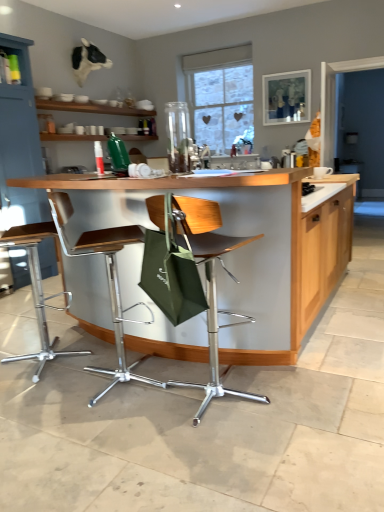
Question: Can you see metallic silver stool at center, positioned as the second chair in left-to-right order, touching matte blue cabinet at upper left?

Choices:
 (A) no
 (B) yes

Answer: (A)

Question: From a real-world perspective, is metallic silver stool at center, which is the second chair in right-to-left order, on top of matte blue cabinet at upper left?

Choices:
 (A) no
 (B) yes

Answer: (A)

Question: Can you confirm if metallic silver stool at center, positioned as the second chair in left-to-right order, is shorter than matte blue cabinet at upper left?

Choices:
 (A) no
 (B) yes

Answer: (B)

Question: Is metallic silver stool at center, positioned as the second chair in left-to-right order, looking in the opposite direction of matte blue cabinet at upper left?

Choices:
 (A) no
 (B) yes

Answer: (A)

Question: From a real-world perspective, is metallic silver stool at center, which is the second chair in right-to-left order, under matte blue cabinet at upper left?

Choices:
 (A) yes
 (B) no

Answer: (A)

Question: Choose the correct answer: Is transparent glass vase at center inside matte blue cabinet at upper left or outside it?

Choices:
 (A) outside
 (B) inside

Answer: (A)

Question: In terms of height, does transparent glass vase at center look taller or shorter compared to matte blue cabinet at upper left?

Choices:
 (A) tall
 (B) short

Answer: (B)

Question: From the image's perspective, is transparent glass vase at center located above or below matte blue cabinet at upper left?

Choices:
 (A) above
 (B) below

Answer: (B)

Question: From a real-world perspective, relative to matte blue cabinet at upper left, is transparent glass vase at center vertically above or below?

Choices:
 (A) above
 (B) below

Answer: (A)

Question: Is wooden countertop at center spatially inside transparent glass vase at center, or outside of it?

Choices:
 (A) outside
 (B) inside

Answer: (A)

Question: Is wooden countertop at center in front of or behind transparent glass vase at center in the image?

Choices:
 (A) front
 (B) behind

Answer: (A)

Question: Is point (281, 271) positioned closer to the camera than point (188, 121)?

Choices:
 (A) farther
 (B) closer

Answer: (B)

Question: Is wooden countertop at center wider or thinner than transparent glass vase at center?

Choices:
 (A) wide
 (B) thin

Answer: (A)

Question: In the image, is metallic silver stool at center, positioned as the second chair in left-to-right order, positioned in front of or behind wooden countertop at center?

Choices:
 (A) front
 (B) behind

Answer: (B)

Question: From a real-world perspective, is metallic silver stool at center, positioned as the second chair in left-to-right order, above or below wooden countertop at center?

Choices:
 (A) below
 (B) above

Answer: (A)